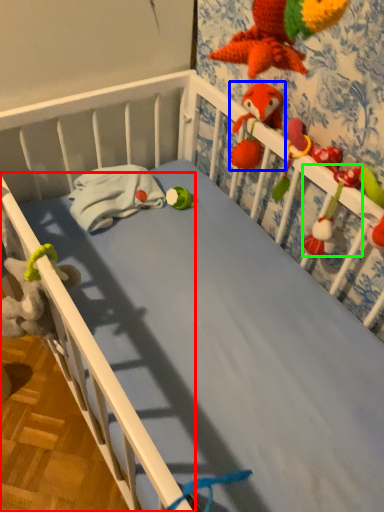
Question: Which object is positioned closest to rail (highlighted by a red box)? Select from toy (highlighted by a blue box) and toy (highlighted by a green box).

Choices:
 (A) toy
 (B) toy

Answer: (B)